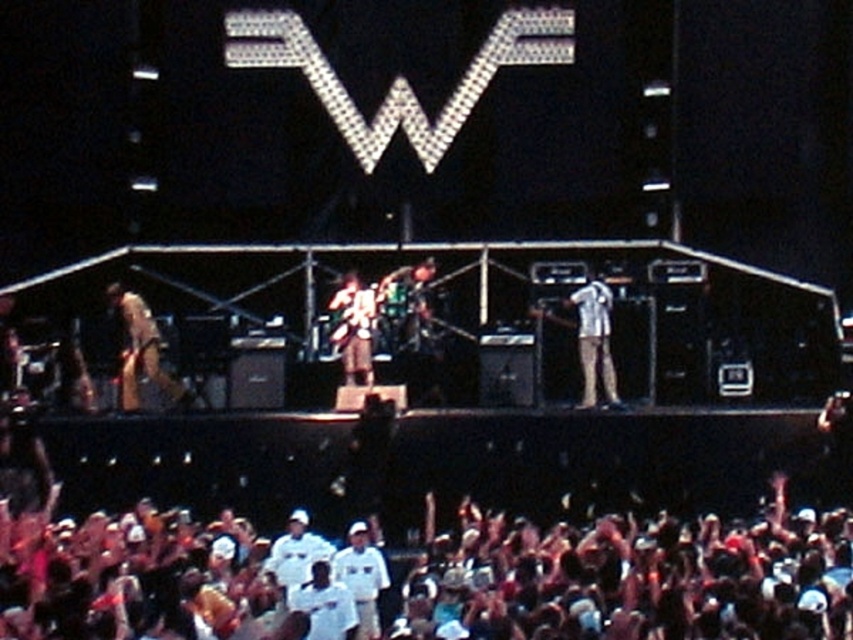
Does point (583, 339) come behind point (335, 300)?

No, (583, 339) is closer to viewer.

Is the position of light blue denim jeans at center less distant than that of dark brown leather jacket at center?

That is True.

Find the location of a particular element. This screenshot has width=853, height=640. light blue denim jeans at center is located at coordinates (595, 340).

Between light brown leather guitar at left and light blue denim jeans at center, which one is positioned lower?

light brown leather guitar at left is lower down.

Which is behind, point (125, 321) or point (596, 304)?

The point (125, 321) is behind.

Which is in front, point (131, 312) or point (614, 404)?

Point (614, 404) is in front.

Image resolution: width=853 pixels, height=640 pixels. In order to click on light brown leather guitar at left in this screenshot , I will do `click(141, 352)`.

Measure the distance between light brown leather guitar at left and dark brown leather jacket at center.

13.10 meters

Can you confirm if light brown leather guitar at left is positioned to the right of dark brown leather jacket at center?

Incorrect, light brown leather guitar at left is not on the right side of dark brown leather jacket at center.

Between point (146, 346) and point (355, 342), which one is positioned behind?

The point (146, 346) is behind.

Identify the location of light brown leather guitar at left. (141, 352).